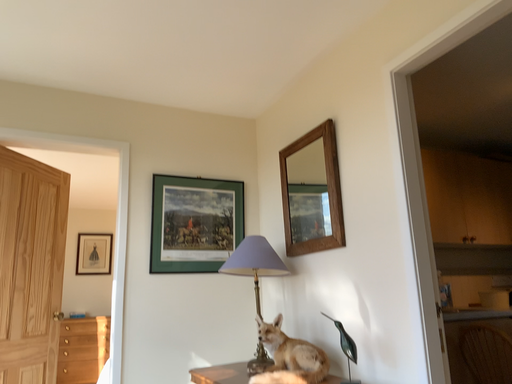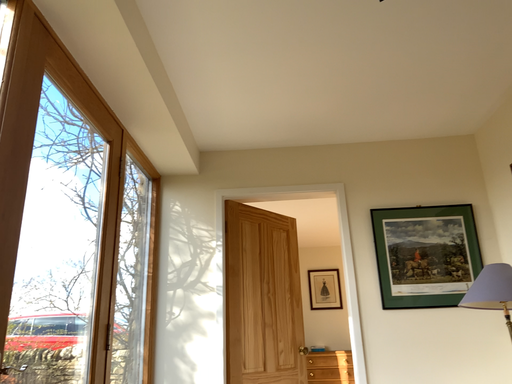
Question: Which way did the camera rotate in the video?

Choices:
 (A) rotated right
 (B) rotated left

Answer: (B)